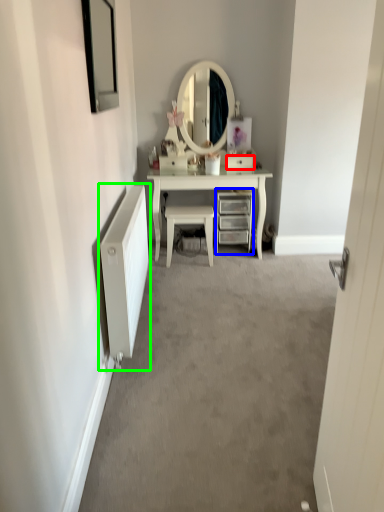
Question: Which is nearer to the drawer (highlighted by a red box)? chest of drawers (highlighted by a blue box) or radiator (highlighted by a green box).

Choices:
 (A) chest of drawers
 (B) radiator

Answer: (A)